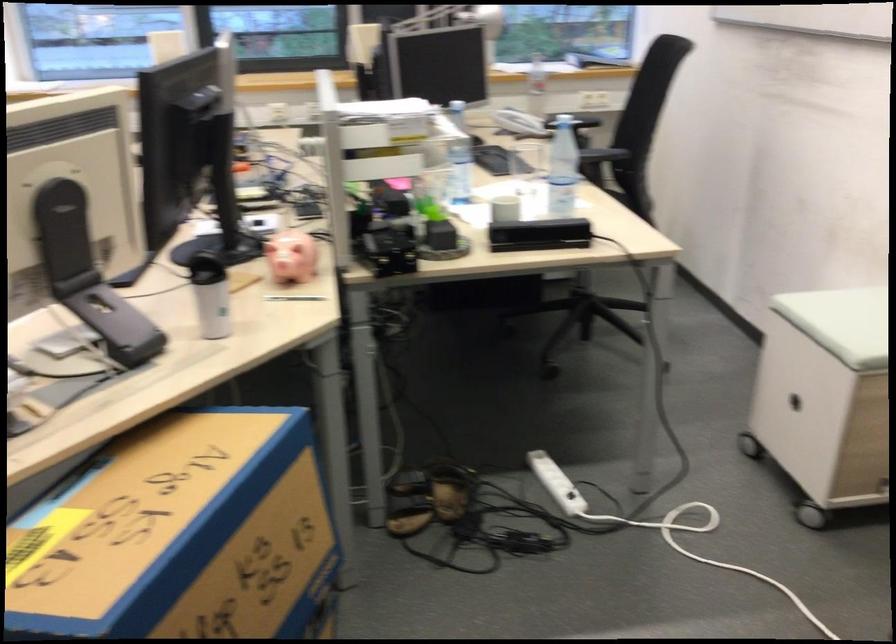
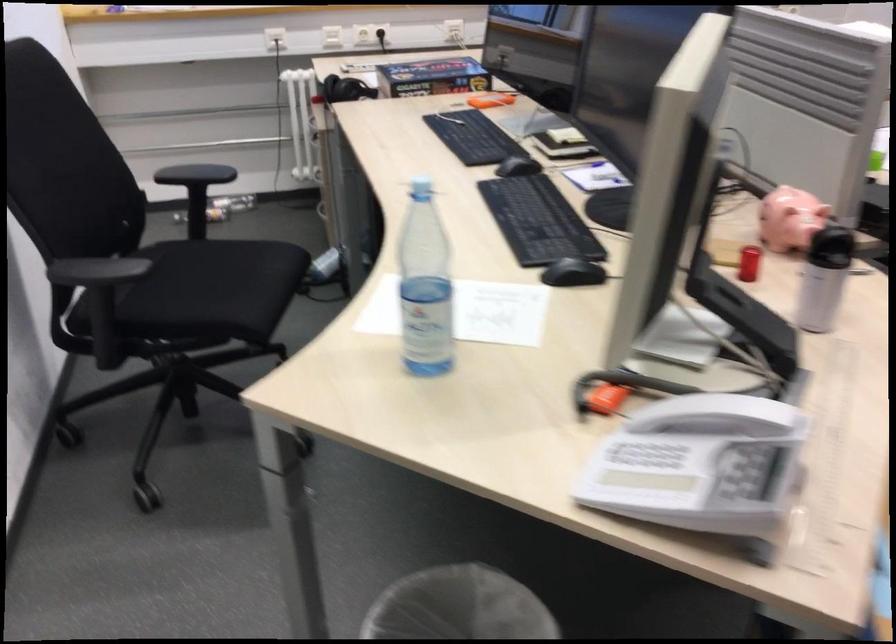
Question: What movement of the cameraman would produce the second image?

Choices:
 (A) Left
 (B) Right
 (C) Forward
 (D) Backward

Answer: (A)